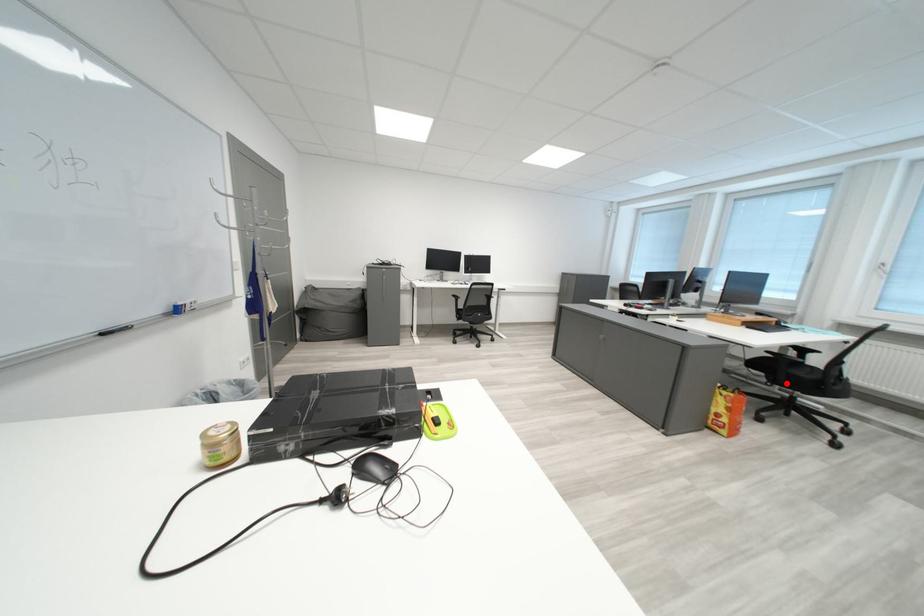
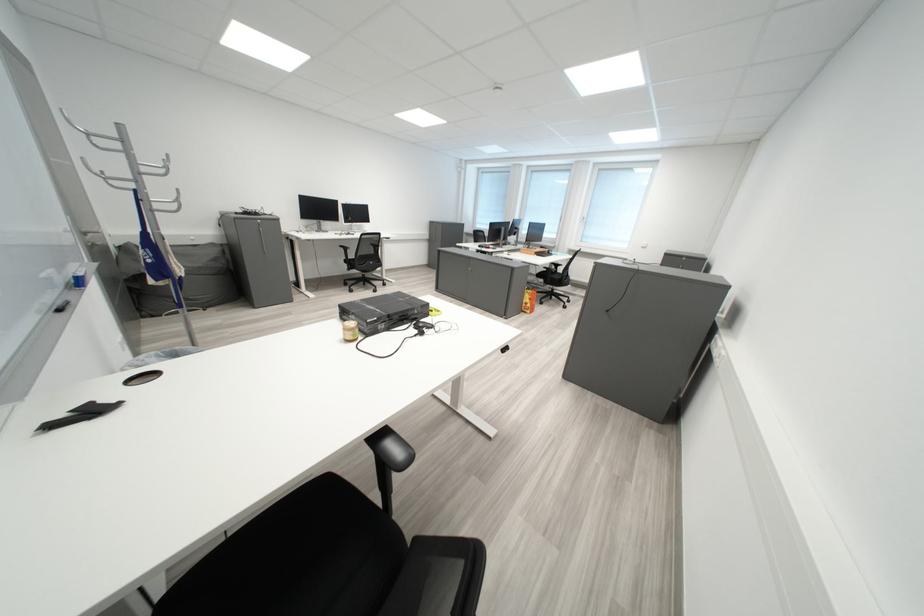
The point at the highlighted location is marked in the first image. Where is the corresponding point in the second image?

(560, 285)